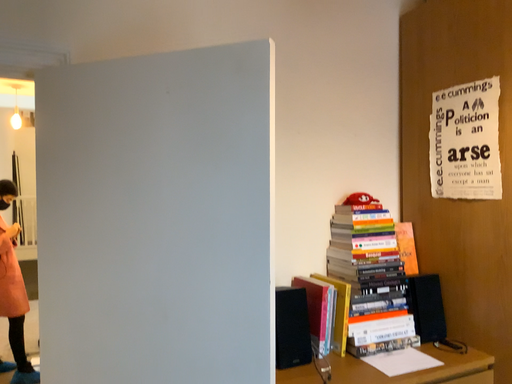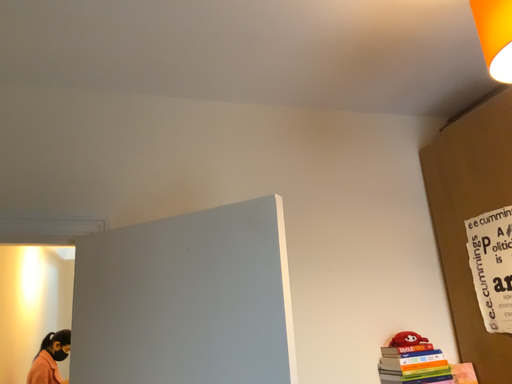
Question: Which way did the camera rotate in the video?

Choices:
 (A) rotated downward
 (B) rotated upward

Answer: (B)